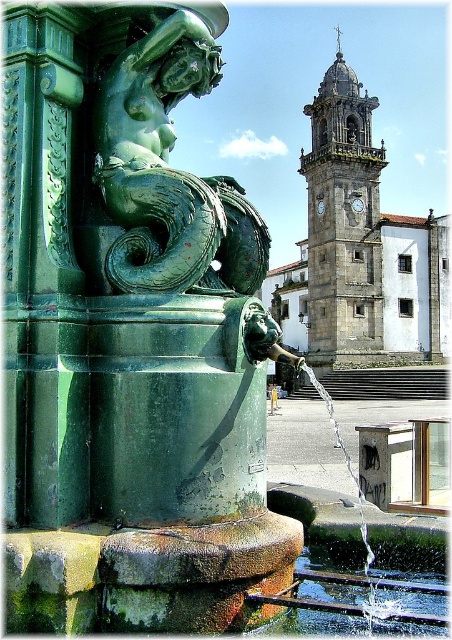
Can you confirm if gray stone clock tower at upper center is taller than clear liquid water at fountain center?

Indeed, gray stone clock tower at upper center has a greater height compared to clear liquid water at fountain center.

Can you confirm if gray stone clock tower at upper center is wider than clear liquid water at fountain center?

Correct, the width of gray stone clock tower at upper center exceeds that of clear liquid water at fountain center.

Which is behind, point (376, 317) or point (412, 632)?

Point (376, 317)

At what (x,y) coordinates should I click in order to perform the action: click on gray stone clock tower at upper center. Please return your answer as a coordinate pair (x, y). Looking at the image, I should click on [343, 221].

Who is higher up, green patinated bronze mermaid at center or clear liquid water at fountain center?

Positioned higher is green patinated bronze mermaid at center.

Looking at this image, does green patinated bronze mermaid at center appear under clear liquid water at fountain center?

Incorrect, green patinated bronze mermaid at center is not positioned below clear liquid water at fountain center.

Who is more forward, (169, 220) or (415, 608)?

Point (169, 220)

This screenshot has height=640, width=452. Identify the location of green patinated bronze mermaid at center. (169, 172).

Between green patinated bronze mermaid at center and gray stone clock tower at upper center, which one has less height?

green patinated bronze mermaid at center is shorter.

Who is positioned more to the right, green patinated bronze mermaid at center or gray stone clock tower at upper center?

Positioned to the right is gray stone clock tower at upper center.

At what (x,y) coordinates should I click in order to perform the action: click on green patinated bronze mermaid at center. Please return your answer as a coordinate pair (x, y). The width and height of the screenshot is (452, 640). Looking at the image, I should click on (169, 172).

Find the location of a particular element. green patinated bronze mermaid at center is located at coordinates (169, 172).